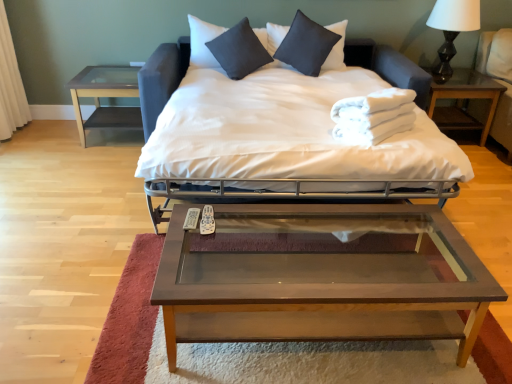
Question: Are clear glass table at left, acting as the first nightstand starting from the left, and dark gray satin pillow at upper center, the first pillow from the right, located far from each other?

Choices:
 (A) no
 (B) yes

Answer: (B)

Question: Is clear glass table at left, which appears as the 2th nightstand when viewed from the right, bigger than dark gray satin pillow at upper center, the first pillow from the right?

Choices:
 (A) yes
 (B) no

Answer: (A)

Question: From the image's perspective, would you say clear glass table at left, acting as the first nightstand starting from the left, is positioned over dark gray satin pillow at upper center, the first pillow from the right?

Choices:
 (A) no
 (B) yes

Answer: (A)

Question: Can you confirm if clear glass table at left, acting as the first nightstand starting from the left, is smaller than dark gray satin pillow at upper center, arranged as the second pillow when viewed from the left?

Choices:
 (A) yes
 (B) no

Answer: (B)

Question: From the image's perspective, is clear glass table at left, acting as the first nightstand starting from the left, under dark gray satin pillow at upper center, the first pillow from the right?

Choices:
 (A) yes
 (B) no

Answer: (A)

Question: From the image's perspective, is white fabric curtain at left located above or below brown wood/glass coffee table at center?

Choices:
 (A) above
 (B) below

Answer: (A)

Question: In the image, is white fabric curtain at left on the left side or the right side of brown wood/glass coffee table at center?

Choices:
 (A) right
 (B) left

Answer: (B)

Question: Does point (11, 94) appear closer or farther from the camera than point (376, 253)?

Choices:
 (A) farther
 (B) closer

Answer: (A)

Question: Is white fabric curtain at left in front of or behind brown wood/glass coffee table at center in the image?

Choices:
 (A) front
 (B) behind

Answer: (B)

Question: From a real-world perspective, relative to dark gray linen pillow at center, the 2th pillow positioned from the right, is white fabric bed at center vertically above or below?

Choices:
 (A) below
 (B) above

Answer: (A)

Question: Is point (289, 114) positioned closer to the camera than point (244, 26)?

Choices:
 (A) farther
 (B) closer

Answer: (B)

Question: Looking at the image, does white fabric bed at center seem bigger or smaller compared to dark gray linen pillow at center, arranged as the 1th pillow when viewed from the left?

Choices:
 (A) big
 (B) small

Answer: (A)

Question: Relative to dark gray linen pillow at center, the 2th pillow positioned from the right, is white fabric bed at center in front or behind?

Choices:
 (A) front
 (B) behind

Answer: (A)

Question: In terms of size, does white fabric towels at right, the second nightstand positioned from the left, appear bigger or smaller than clear glass table at left, acting as the first nightstand starting from the left?

Choices:
 (A) small
 (B) big

Answer: (B)

Question: Do you think white fabric towels at right, the second nightstand positioned from the left, is within clear glass table at left, which appears as the 2th nightstand when viewed from the right, or outside of it?

Choices:
 (A) outside
 (B) inside

Answer: (A)